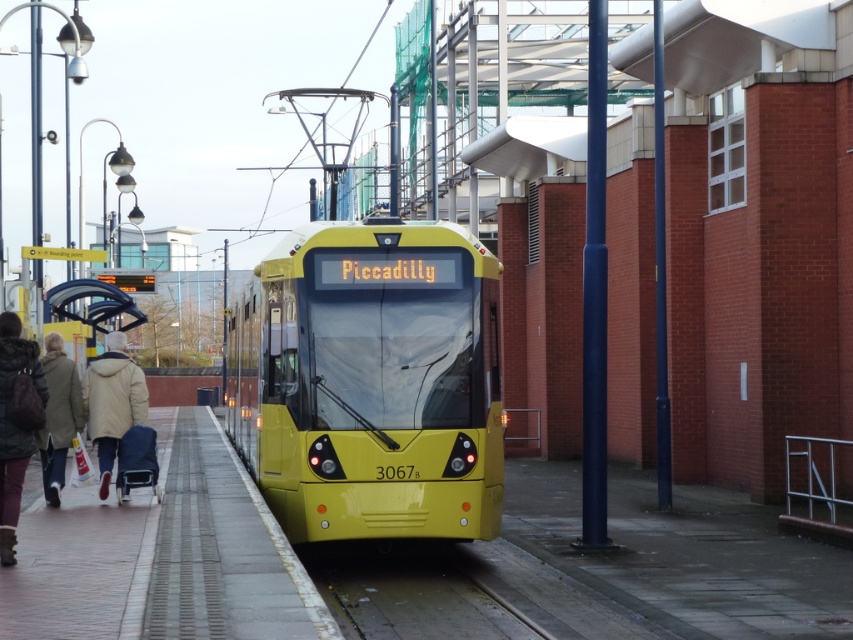
Who is taller, yellow matte train at center or brick pavement at lower left?

With more height is yellow matte train at center.

Based on the photo, does yellow matte train at center have a greater height compared to brick pavement at lower left?

Indeed, yellow matte train at center has a greater height compared to brick pavement at lower left.

What are the coordinates of `yellow matte train at center` in the screenshot? It's located at (370, 381).

Identify the location of yellow matte train at center. Image resolution: width=853 pixels, height=640 pixels. (370, 381).

Is point (178, 525) closer to viewer compared to point (108, 435)?

Yes, point (178, 525) is closer to viewer.

Is brick pavement at lower left shorter than beige woolen coat at left?

Indeed, brick pavement at lower left has a lesser height compared to beige woolen coat at left.

Where is `brick pavement at lower left`? Image resolution: width=853 pixels, height=640 pixels. brick pavement at lower left is located at coordinates (163, 556).

Is velvet brown coat at lower left positioned in front of light brown leather coat at lower left?

Yes, it is in front of light brown leather coat at lower left.

Does velvet brown coat at lower left have a greater height compared to light brown leather coat at lower left?

Yes, velvet brown coat at lower left is taller than light brown leather coat at lower left.

Is point (9, 563) positioned before point (54, 426)?

That is True.

What are the coordinates of `velvet brown coat at lower left` in the screenshot? It's located at (15, 426).